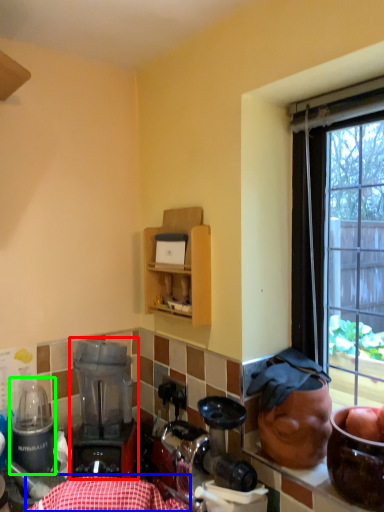
Question: Which is farther away from blender (highlighted by a red box)? tablecloth (highlighted by a blue box) or appliance (highlighted by a green box)?

Choices:
 (A) tablecloth
 (B) appliance

Answer: (A)